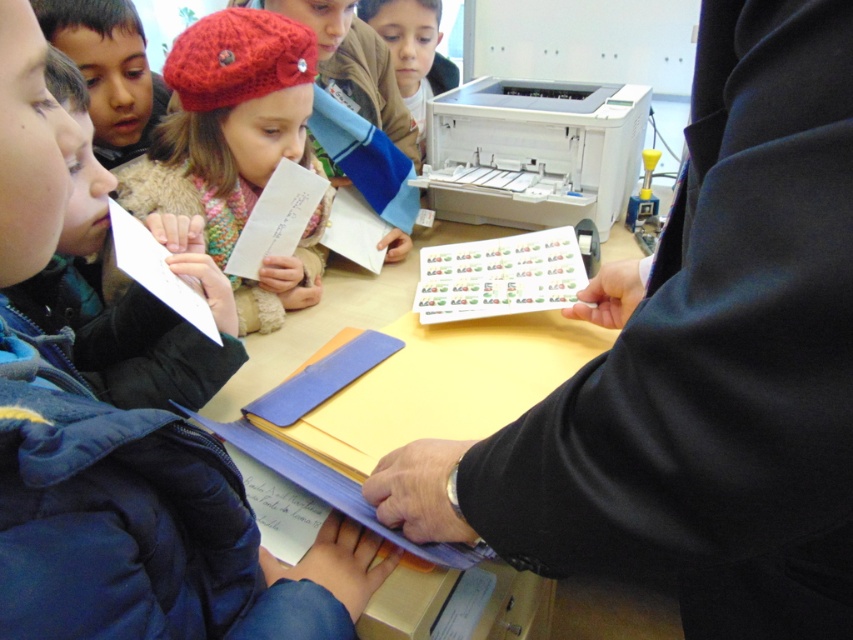
You are a child trying to reach the white paper at center on the yellow matte table at center. Considering the height difference, can you reach it without any assistance?

The yellow matte table at center is much taller than the white paper at center, so the white paper at center is placed lower. Since the table is taller, the paper might be positioned in a way that makes it accessible, but the description only mentions height comparison between the table and the paper, not the child height. However, based on typical scenarios, a standard table might be too high for a child to reach without help. But according to the given info, the paper is at center and the table is taller,

In the scene shown: You are a student trying to organize your materials on the table. You need to place a new folder exactly where the black matte folder at center is currently located. According to the coordinates provided, where should you position the new folder?

The black matte folder at center should be placed at the coordinates point (699, 368).